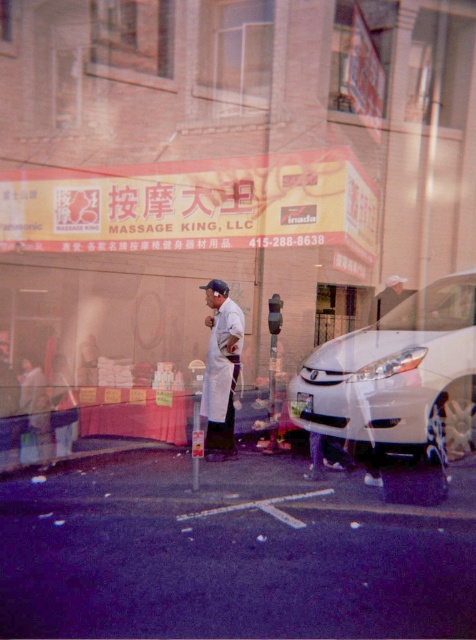
You are a pedestrian standing in front of the Massage King, LLC storefront. You see a white glossy car at right and a white lab coat at center. Which object is positioned higher in the image?

The white glossy car at right is located above the white lab coat at center, so it is positioned higher in the image.

You are a delivery person who needs to park your van near the Massage King, LLC store. The parking spot is marked by a yellow matte signboard at center. However, there is a white glossy car at right blocking the entrance. From the driver seat, which side of the car should you go around to reach the signboard?

The yellow matte signboard at center is to the left of the white glossy car at right, so you should go around the left side of the white glossy car at right to reach the signboard.